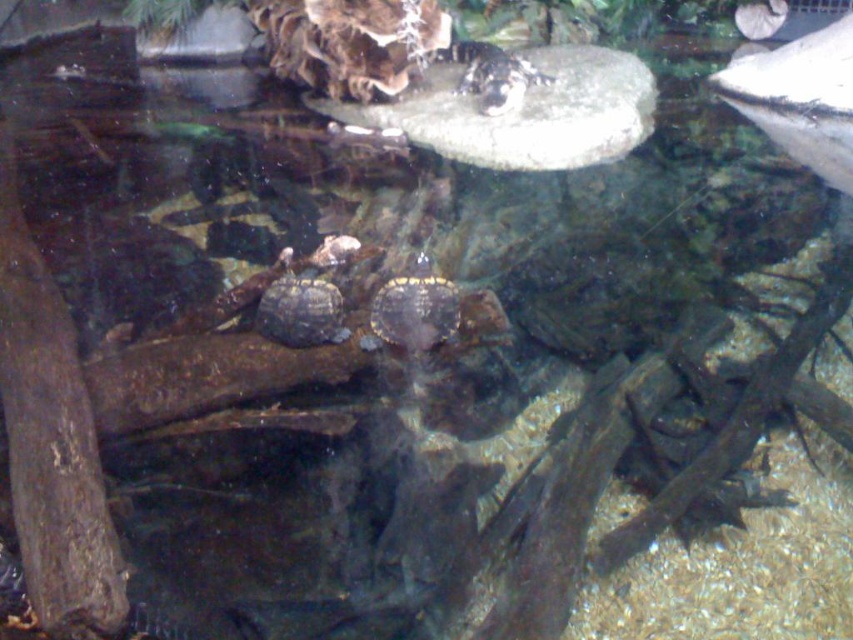
Which of these two, brown matte tortoise at center or brown textured shell at upper center, stands taller?

brown textured shell at upper center is taller.

Does brown matte tortoise at center come in front of brown textured shell at upper center?

Yes, brown matte tortoise at center is in front of brown textured shell at upper center.

What do you see at coordinates (300, 310) in the screenshot? I see `brown matte tortoise at center` at bounding box center [300, 310].

Locate an element on the screen. This screenshot has width=853, height=640. brown matte tortoise at center is located at coordinates (300, 310).

Which of these two, shiny brown tortoise at center or brown textured shell at upper center, stands shorter?

Standing shorter between the two is shiny brown tortoise at center.

I want to click on shiny brown tortoise at center, so click(415, 310).

Locate an element on the screen. This screenshot has width=853, height=640. shiny brown tortoise at center is located at coordinates (415, 310).

Who is lower down, shiny brown tortoise at center or brown matte tortoise at center?

brown matte tortoise at center is below.

Which is above, shiny brown tortoise at center or brown matte tortoise at center?

shiny brown tortoise at center

Is point (396, 301) less distant than point (320, 301)?

No.

Identify the location of shiny brown tortoise at center. (415, 310).